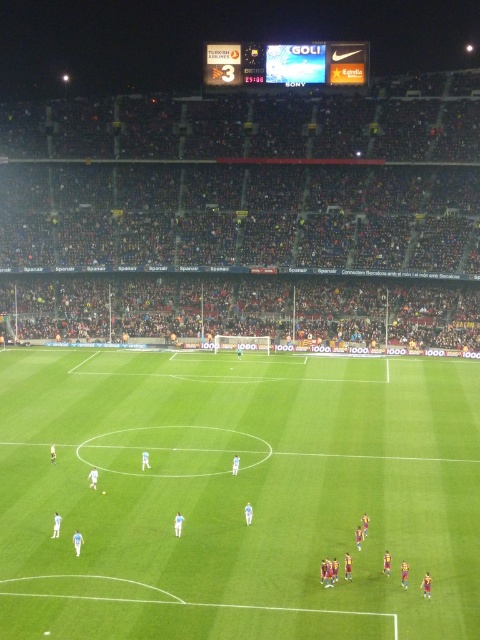
Question: Considering the relative positions of green grass field at center and maroon jersey players at center in the image provided, where is green grass field at center located with respect to maroon jersey players at center?

Choices:
 (A) left
 (B) right

Answer: (B)

Question: Does green grass field at center appear under maroon jersey players at center?

Choices:
 (A) no
 (B) yes

Answer: (A)

Question: Is green grass field at center further to camera compared to maroon jersey players at center?

Choices:
 (A) yes
 (B) no

Answer: (B)

Question: Among these points, which one is farthest from the camera?

Choices:
 (A) tap(115, 440)
 (B) tap(194, 540)

Answer: (A)

Question: Which object is closer to the camera taking this photo?

Choices:
 (A) green grass field at center
 (B) maroon jersey players at center

Answer: (A)